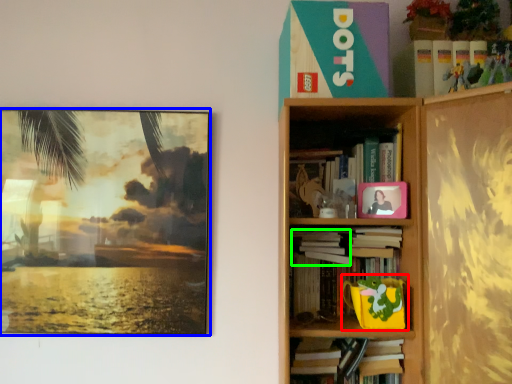
Question: Estimate the real-world distances between objects in this image. Which object is farther from toy (highlighted by a red box), picture frame (highlighted by a blue box) or book (highlighted by a green box)?

Choices:
 (A) picture frame
 (B) book

Answer: (A)